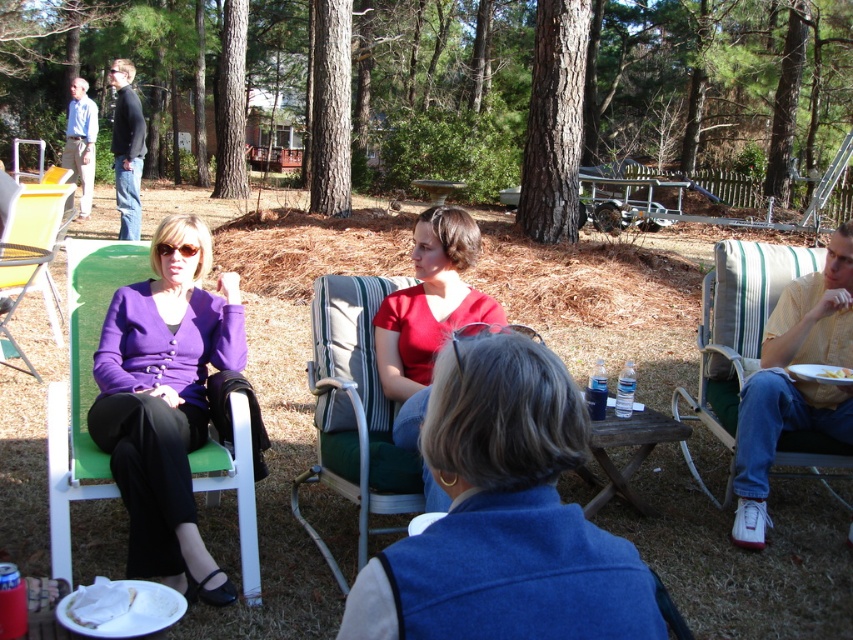
Question: Among these objects, which one is farthest from the camera?

Choices:
 (A) matte red shirt at center
 (B) green fabric chair at center
 (C) brown wooden picnic table at center

Answer: (C)

Question: Which point appears farthest from the camera in this image?

Choices:
 (A) 764,278
 (B) 370,401
 (C) 33,376

Answer: (C)

Question: Which is nearer to the brown wooden picnic table at center?

Choices:
 (A) matte red shirt at center
 (B) green fabric chair at center
 (C) matte plastic chair at left

Answer: (A)

Question: Can you confirm if green striped fabric chair at right is positioned to the right of matte red shirt at center?

Choices:
 (A) no
 (B) yes

Answer: (B)

Question: Is green fabric chair at center closer to the viewer compared to green striped fabric chair at right?

Choices:
 (A) no
 (B) yes

Answer: (B)

Question: Is matte plastic chair at left below brown wooden picnic table at center?

Choices:
 (A) no
 (B) yes

Answer: (A)